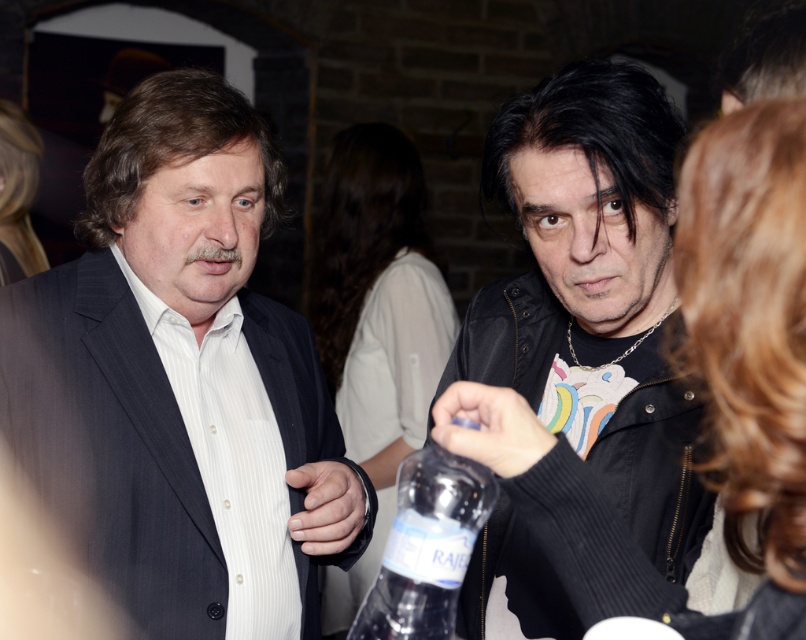
Question: Does matte black suit at left lie behind black leather jacket at center?

Choices:
 (A) no
 (B) yes

Answer: (B)

Question: Which of the following is the closest to the observer?

Choices:
 (A) (414, 483)
 (B) (667, 275)
 (C) (198, 177)

Answer: (A)

Question: Considering the relative positions of matte black suit at left and clear plastic bottle at center in the image provided, where is matte black suit at left located with respect to clear plastic bottle at center?

Choices:
 (A) below
 (B) above

Answer: (B)

Question: Which object is the farthest from the matte black suit at left?

Choices:
 (A) clear plastic bottle at center
 (B) black leather jacket at center

Answer: (A)

Question: Can you confirm if matte black suit at left is positioned above black leather jacket at center?

Choices:
 (A) yes
 (B) no

Answer: (B)

Question: Among these objects, which one is farthest from the camera?

Choices:
 (A) black leather jacket at center
 (B) clear plastic bottle at center

Answer: (A)